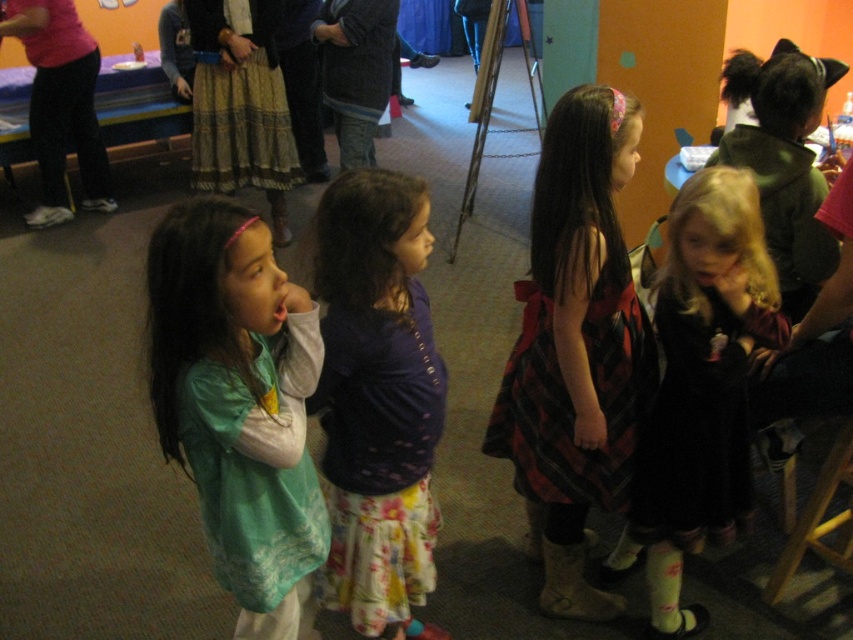
In the scene shown: You are a photographer standing at the entrance of the playroom. You want to take a photo of two points marked in the image. The first point is at coordinate point (671, 392), and the second is at point (822, 480). Which point is closer to you?

Point (671, 392) is in front of point (822, 480), so the first point is closer to you.

Based on the photo, you are a photographer setting up for a group photo in the playroom. You notice two children wearing the plaid fabric dress at center and the floral skirt at center. Which child should you position closer to the camera to ensure both appear equally sized in the photo?

To make both the plaid fabric dress at center and the floral skirt at center appear equally sized in the photo, position the floral skirt at center closer to the camera since it is smaller in size than the plaid fabric dress at center.

You are a photographer setting up for a group photo. You notice the floral skirt at center and the black velvet dress at right. Which of these two items is shorter in height?

The floral skirt at center has a lesser height compared to the black velvet dress at right, so the floral skirt at center is shorter in height.